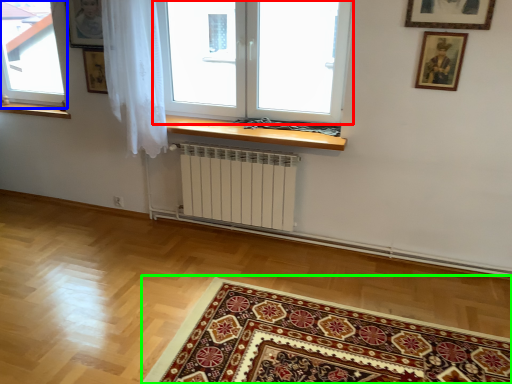
Question: Estimate the real-world distances between objects in this image. Which object is farther from window (highlighted by a red box), window (highlighted by a blue box) or mat (highlighted by a green box)?

Choices:
 (A) window
 (B) mat

Answer: (A)